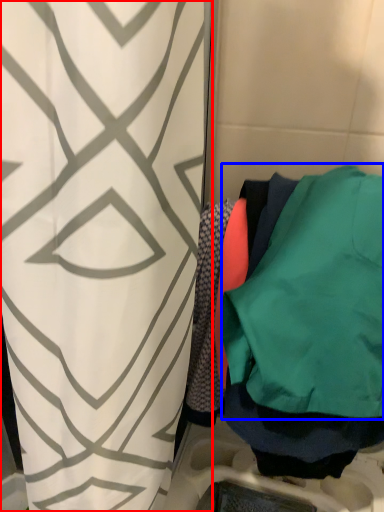
Question: Which point is closer to the camera, curtain (highlighted by a red box) or sweatshirt (highlighted by a blue box)?

Choices:
 (A) curtain
 (B) sweatshirt

Answer: (A)